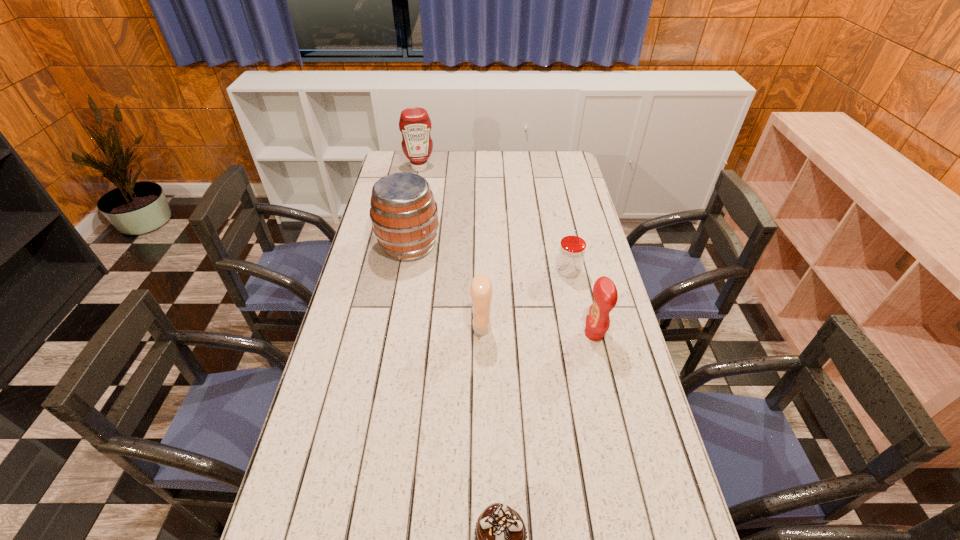
At what (x,y) coordinates should I click in order to perform the action: click on vacant space situated on the label side of the rightmost condiment. Please return your answer as a coordinate pair (x, y). Image resolution: width=960 pixels, height=540 pixels. Looking at the image, I should click on (541, 334).

Identify the location of vacant space positioned on the label of the second condiment from left to right. (414, 328).

At what (x,y) coordinates should I click in order to perform the action: click on free space located 0.390m on the label of the second condiment from left to right. Please return your answer as a coordinate pair (x, y). The width and height of the screenshot is (960, 540). Looking at the image, I should click on (347, 328).

Locate an element on the screen. The image size is (960, 540). free space located on the label of the second condiment from left to right is located at coordinates point(445,328).

Identify the location of vacant space located 0.350m on the left of the jar. Image resolution: width=960 pixels, height=540 pixels. pos(457,272).

The width and height of the screenshot is (960, 540). I want to click on object located at the far edge, so click(414, 123).

The height and width of the screenshot is (540, 960). In order to click on condiment that is at the left edge in this screenshot , I will do `click(414, 123)`.

Where is `cider located in the left edge section of the desktop`? cider located in the left edge section of the desktop is located at coordinates (403, 212).

Image resolution: width=960 pixels, height=540 pixels. I want to click on condiment present at the right edge, so click(605, 294).

Where is `jar at the right edge`? The height and width of the screenshot is (540, 960). jar at the right edge is located at coordinates (571, 253).